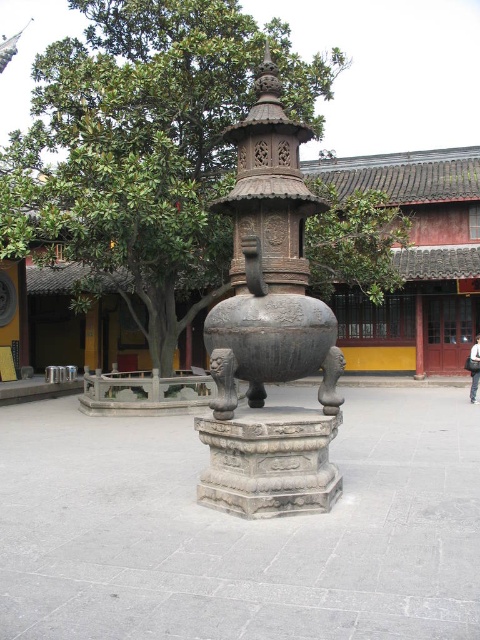
You are standing in the courtyard and want to place a new decorative item between the green leafy tree at center and the polished bronze incense burner at center. Based on their positions, where should you place the item to ensure it is between them?

The green leafy tree at center is located above the polished bronze incense burner at center, so placing the item between them would require positioning it below the tree and above the incense burner.

You are standing in the courtyard and want to see the dark gray stone incense burner at center clearly. However, the green leafy tree at center is blocking your view. How can you adjust your position to see the incense burner?

Move to the side of the green leafy tree at center so that the dark gray stone incense burner at center is no longer blocked by the tree.

You are standing in a traditional Chinese courtyard and want to take a closer look at the dark gray stone incense burner at center. If you walk straight ahead, will you reach the burner before the building in the background?

The dark gray stone incense burner at center is 6.48 meters away from the camera. Since the building is further back in the background, you will reach the burner before the building.